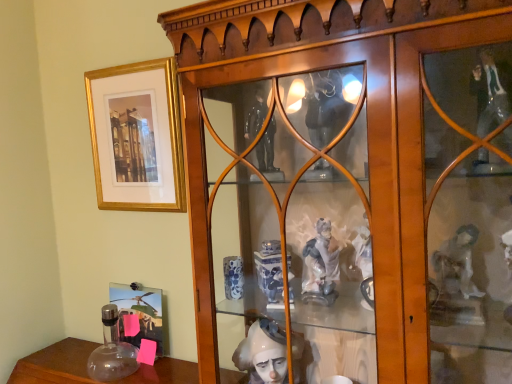
This screenshot has height=384, width=512. What do you see at coordinates (137, 136) in the screenshot?
I see `gold/matte picture frame at upper left, which ranks as the first picture frame in top-to-bottom order` at bounding box center [137, 136].

Locate an element on the screen. metallic silver photo frame at lower left, the first picture frame when ordered from bottom to top is located at coordinates (139, 312).

Can you tell me how much metallic silver photo frame at lower left, marked as the 2th picture frame in a top-to-bottom arrangement, and wooden cabinet at center differ in facing direction?

3.88 degrees separate the facing orientations of metallic silver photo frame at lower left, marked as the 2th picture frame in a top-to-bottom arrangement, and wooden cabinet at center.

Considering the relative sizes of metallic silver photo frame at lower left, the first picture frame when ordered from bottom to top, and wooden cabinet at center in the image provided, is metallic silver photo frame at lower left, the first picture frame when ordered from bottom to top, wider than wooden cabinet at center?

No.

Between metallic silver photo frame at lower left, the first picture frame when ordered from bottom to top, and wooden cabinet at center, which one appears on the right side from the viewer's perspective?

wooden cabinet at center.

Which of these two, metallic silver photo frame at lower left, the first picture frame when ordered from bottom to top, or wooden cabinet at center, stands shorter?

Standing shorter between the two is metallic silver photo frame at lower left, the first picture frame when ordered from bottom to top.

Where is `furniture below the gold/matte picture frame at upper left, acting as the second picture frame starting from the bottom (from the image's perspective)`? furniture below the gold/matte picture frame at upper left, acting as the second picture frame starting from the bottom (from the image's perspective) is located at coordinates (352, 185).

Between gold/matte picture frame at upper left, acting as the second picture frame starting from the bottom, and wooden cabinet at center, which one has smaller size?

With smaller size is gold/matte picture frame at upper left, acting as the second picture frame starting from the bottom.

From a real-world perspective, does gold/matte picture frame at upper left, acting as the second picture frame starting from the bottom, sit lower than wooden cabinet at center?

Actually, gold/matte picture frame at upper left, acting as the second picture frame starting from the bottom, is physically above wooden cabinet at center in the real world.

How different are the orientations of wooden cabinet at center and gold/matte picture frame at upper left, which ranks as the first picture frame in top-to-bottom order, in degrees?

wooden cabinet at center and gold/matte picture frame at upper left, which ranks as the first picture frame in top-to-bottom order, are facing 2.56 degrees away from each other.

Starting from the wooden cabinet at center, which picture frame is the 1st one to the left? Please provide its 2D coordinates.

[(137, 136)]

Is wooden cabinet at center with gold/matte picture frame at upper left, which ranks as the first picture frame in top-to-bottom order?

No, wooden cabinet at center is not beside gold/matte picture frame at upper left, which ranks as the first picture frame in top-to-bottom order.

Which of these two, wooden cabinet at center or gold/matte picture frame at upper left, acting as the second picture frame starting from the bottom, is smaller?

gold/matte picture frame at upper left, acting as the second picture frame starting from the bottom.

Considering the relative sizes of wooden cabinet at center and metallic silver photo frame at lower left, marked as the 2th picture frame in a top-to-bottom arrangement, in the image provided, is wooden cabinet at center thinner than metallic silver photo frame at lower left, marked as the 2th picture frame in a top-to-bottom arrangement,?

No.

Is wooden cabinet at center next to metallic silver photo frame at lower left, marked as the 2th picture frame in a top-to-bottom arrangement, and touching it?

No, wooden cabinet at center is not next to metallic silver photo frame at lower left, marked as the 2th picture frame in a top-to-bottom arrangement.

Considering the positions of objects wooden cabinet at center and metallic silver photo frame at lower left, marked as the 2th picture frame in a top-to-bottom arrangement, in the image provided, who is behind, wooden cabinet at center or metallic silver photo frame at lower left, marked as the 2th picture frame in a top-to-bottom arrangement,?

metallic silver photo frame at lower left, marked as the 2th picture frame in a top-to-bottom arrangement.

From the image's perspective, which is above, wooden cabinet at center or metallic silver photo frame at lower left, the first picture frame when ordered from bottom to top?

From the image's view, wooden cabinet at center is above.

Does gold/matte picture frame at upper left, acting as the second picture frame starting from the bottom, touch metallic silver photo frame at lower left, marked as the 2th picture frame in a top-to-bottom arrangement?

They are not placed beside each other.

How much distance is there between gold/matte picture frame at upper left, acting as the second picture frame starting from the bottom, and metallic silver photo frame at lower left, marked as the 2th picture frame in a top-to-bottom arrangement?

gold/matte picture frame at upper left, acting as the second picture frame starting from the bottom, and metallic silver photo frame at lower left, marked as the 2th picture frame in a top-to-bottom arrangement, are 18.97 inches apart from each other.

The width and height of the screenshot is (512, 384). I want to click on picture frame below the gold/matte picture frame at upper left, which ranks as the first picture frame in top-to-bottom order (from the image's perspective), so click(139, 312).

In the scene shown: Is gold/matte picture frame at upper left, acting as the second picture frame starting from the bottom, in front of metallic silver photo frame at lower left, the first picture frame when ordered from bottom to top?

Yes, gold/matte picture frame at upper left, acting as the second picture frame starting from the bottom, is closer to the viewer.

Could you tell me if metallic silver photo frame at lower left, the first picture frame when ordered from bottom to top, is turned towards gold/matte picture frame at upper left, which ranks as the first picture frame in top-to-bottom order?

No, metallic silver photo frame at lower left, the first picture frame when ordered from bottom to top, is not facing towards gold/matte picture frame at upper left, which ranks as the first picture frame in top-to-bottom order.

Does metallic silver photo frame at lower left, the first picture frame when ordered from bottom to top, have a larger size compared to gold/matte picture frame at upper left, which ranks as the first picture frame in top-to-bottom order?

Actually, metallic silver photo frame at lower left, the first picture frame when ordered from bottom to top, might be smaller than gold/matte picture frame at upper left, which ranks as the first picture frame in top-to-bottom order.

Which is in front, point (131, 343) or point (94, 76)?

Positioned in front is point (94, 76).

In the image, is metallic silver photo frame at lower left, marked as the 2th picture frame in a top-to-bottom arrangement, positioned in front of or behind gold/matte picture frame at upper left, which ranks as the first picture frame in top-to-bottom order?

metallic silver photo frame at lower left, marked as the 2th picture frame in a top-to-bottom arrangement, is behind gold/matte picture frame at upper left, which ranks as the first picture frame in top-to-bottom order.

What are the coordinates of `furniture lying on the right of metallic silver photo frame at lower left, marked as the 2th picture frame in a top-to-bottom arrangement` in the screenshot? It's located at (352, 185).

You are a GUI agent. You are given a task and a screenshot of the screen. Output one action in this format:
    pyautogui.click(x=<x>, y=<y>)
    Task: Click on the picture frame above the wooden cabinet at center (from the image's perspective)
    
    Given the screenshot: What is the action you would take?
    click(x=137, y=136)

In the scene shown: Looking at the image, which one is located closer to gold/matte picture frame at upper left, acting as the second picture frame starting from the bottom, wooden cabinet at center or metallic silver photo frame at lower left, marked as the 2th picture frame in a top-to-bottom arrangement?

wooden cabinet at center.

When comparing their distances from metallic silver photo frame at lower left, marked as the 2th picture frame in a top-to-bottom arrangement, does gold/matte picture frame at upper left, acting as the second picture frame starting from the bottom, or wooden cabinet at center seem closer?

The object closer to metallic silver photo frame at lower left, marked as the 2th picture frame in a top-to-bottom arrangement, is gold/matte picture frame at upper left, acting as the second picture frame starting from the bottom.

Which object lies nearer to the anchor point wooden cabinet at center, gold/matte picture frame at upper left, which ranks as the first picture frame in top-to-bottom order, or metallic silver photo frame at lower left, marked as the 2th picture frame in a top-to-bottom arrangement?

Among the two, gold/matte picture frame at upper left, which ranks as the first picture frame in top-to-bottom order, is located nearer to wooden cabinet at center.

Considering their positions, is wooden cabinet at center positioned closer to metallic silver photo frame at lower left, marked as the 2th picture frame in a top-to-bottom arrangement, than gold/matte picture frame at upper left, which ranks as the first picture frame in top-to-bottom order?

gold/matte picture frame at upper left, which ranks as the first picture frame in top-to-bottom order, lies closer to metallic silver photo frame at lower left, marked as the 2th picture frame in a top-to-bottom arrangement, than the other object.

When comparing their distances from wooden cabinet at center, does metallic silver photo frame at lower left, marked as the 2th picture frame in a top-to-bottom arrangement, or gold/matte picture frame at upper left, which ranks as the first picture frame in top-to-bottom order, seem further?

metallic silver photo frame at lower left, marked as the 2th picture frame in a top-to-bottom arrangement, lies further to wooden cabinet at center than the other object.

Based on their spatial positions, is metallic silver photo frame at lower left, the first picture frame when ordered from bottom to top, or wooden cabinet at center closer to gold/matte picture frame at upper left, which ranks as the first picture frame in top-to-bottom order?

The object closer to gold/matte picture frame at upper left, which ranks as the first picture frame in top-to-bottom order, is wooden cabinet at center.

Identify the location of picture frame between wooden cabinet at center and metallic silver photo frame at lower left, marked as the 2th picture frame in a top-to-bottom arrangement, in the front-back direction. This screenshot has width=512, height=384. (137, 136).